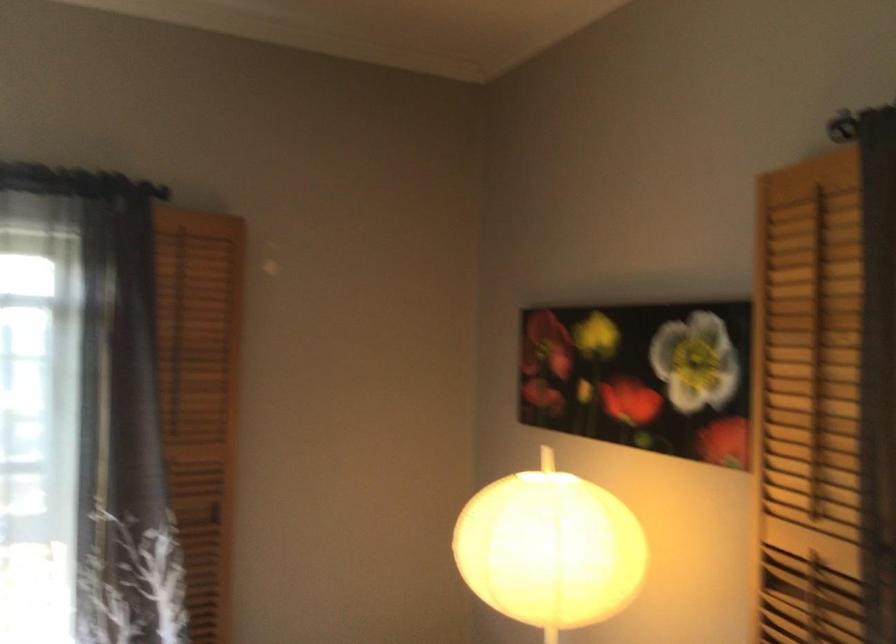
The image size is (896, 644). Identify the location of dark curtain rod finial. (76, 182).